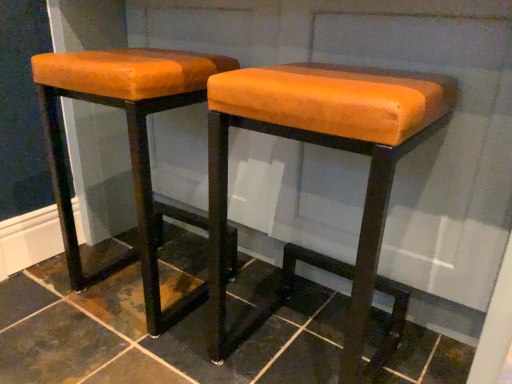
The image size is (512, 384). In order to click on vacant space behind orange leather stool at center, the first stool in the right-to-left sequence in this screenshot , I will do pyautogui.click(x=281, y=286).